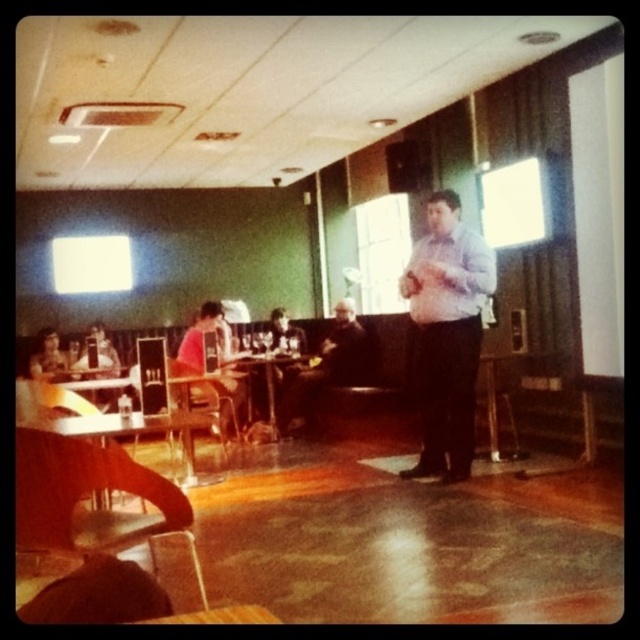
Question: Is brown leather chair at lower left positioned in front of matte black laptop at left?

Choices:
 (A) yes
 (B) no

Answer: (A)

Question: Which object appears closest to the camera in this image?

Choices:
 (A) white glossy projector screen at upper left
 (B) pink fabric shirt at center
 (C) white matte projection screen at upper right
 (D) matte black laptop at left

Answer: (B)

Question: Can you confirm if metallic silver chair at center is positioned above pink fabric shirt at center?

Choices:
 (A) yes
 (B) no

Answer: (B)

Question: Which of the following is the closest to the observer?

Choices:
 (A) (483, 186)
 (B) (426, 384)

Answer: (B)

Question: Which point is farther to the camera?

Choices:
 (A) metallic silver chair at center
 (B) matte blue shirt at center

Answer: (A)

Question: Is matte blue shirt at center to the left of brown leather chair at lower left from the viewer's perspective?

Choices:
 (A) yes
 (B) no

Answer: (B)